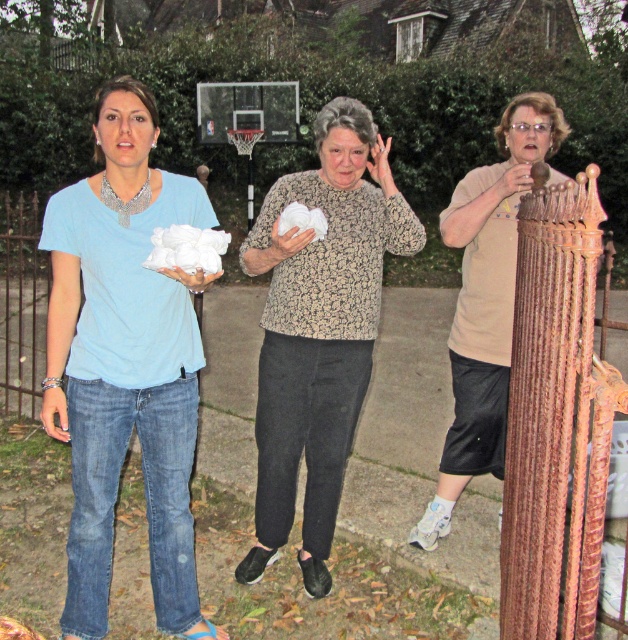
What is located at the coordinates point (320, 330)?

The white textured sweater at center is located at point (320, 330).

You are a photographer trying to arrange the matte blue shirt at center and the beige matte shirt at right for a photo shoot. Based on their heights, which one should you place in the back to ensure both are visible?

The matte blue shirt at center is taller than the beige matte shirt at right, so you should place the matte blue shirt at center in the back to ensure both are visible.